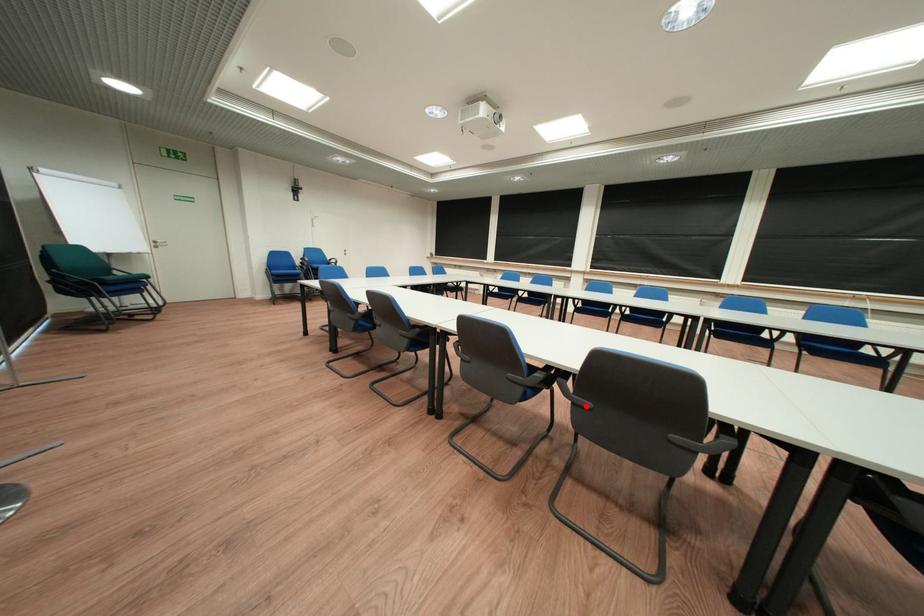
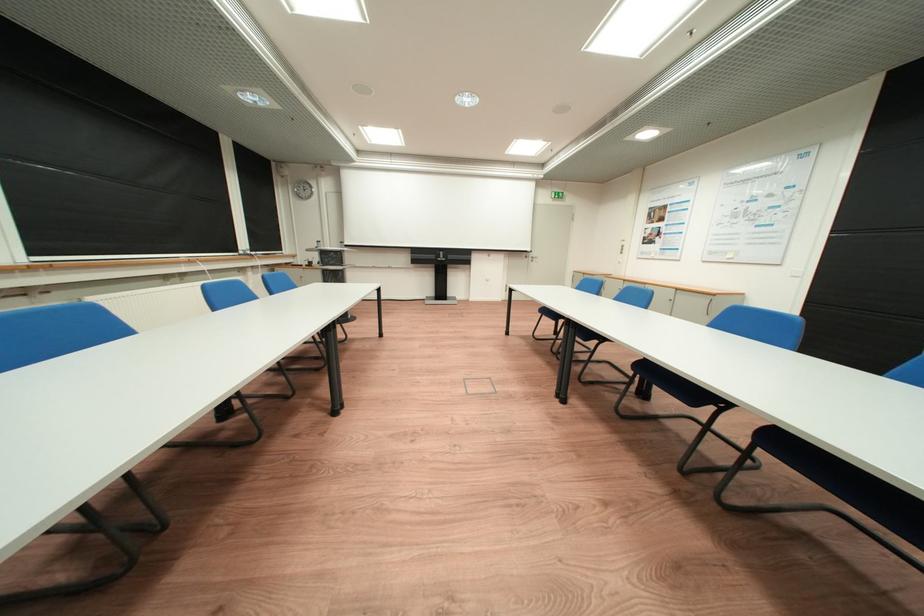
Question: I am providing you with two images of the same scene from different viewpoints. A red point is marked on the first image. Can you still see the location of the red point in image 2?

Choices:
 (A) Yes
 (B) No

Answer: (B)